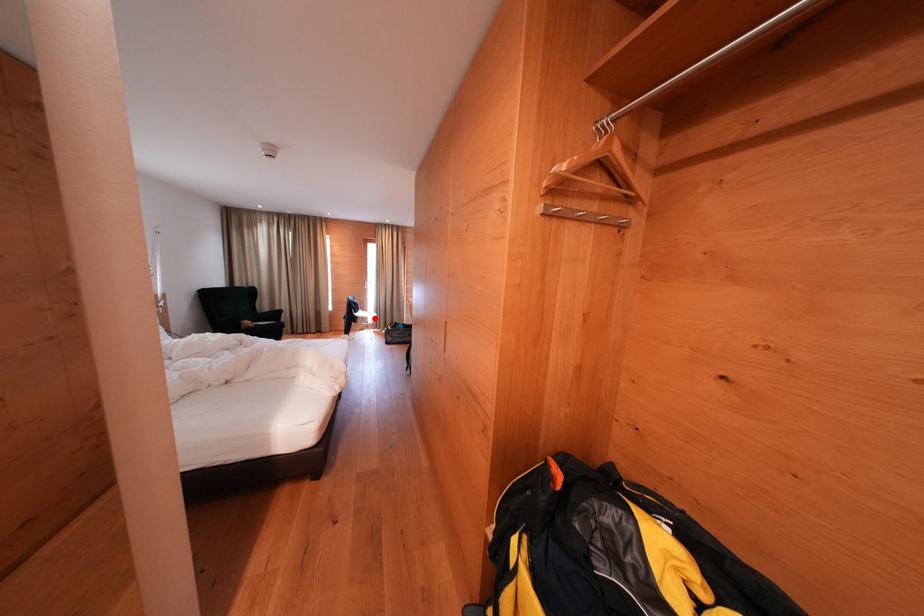
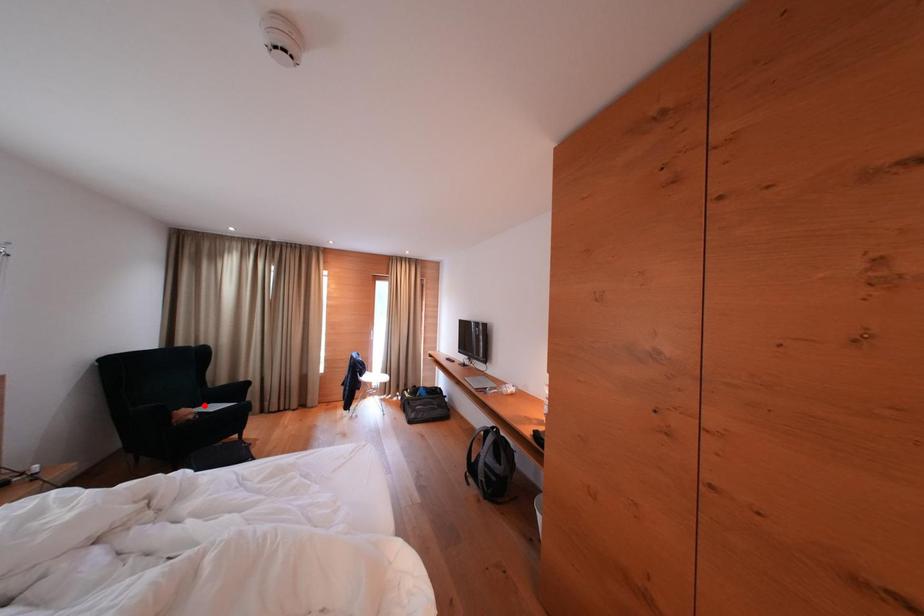
I am providing you with two images of the same scene from different viewpoints. A red point is marked on the first image and another point is marked on the second image. Does the point marked in image1 correspond to the same location as the one in image2?

No